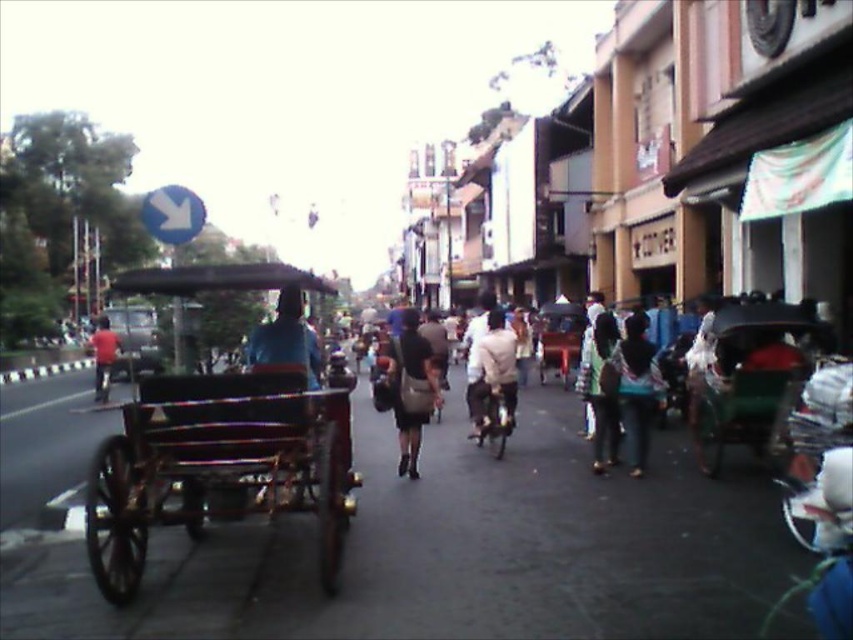
You are a delivery person who needs to decide which item to place on the top shelf of your storage unit. The shelf has limited height capacity. Which item should you choose between the dark brown leather bag at center and the light brown leather jacket at center?

The dark brown leather bag at center has a greater height compared to the light brown leather jacket at center, so you should choose the light brown leather jacket at center to place on the top shelf since it is shorter and less likely to exceed the height limit.

You are standing on the bustling street scene and want to take a photo. There are two points of interest marked as point (735, 369) and point (627, 336). Which point will appear larger in your photo?

Point (735, 369) is closer to the camera than point (627, 336), so it will appear larger in the photo.

Consider the image. You are a delivery person who needs to move a package from the wooden wagon at left to the matte black bag at center. Which direction should you move the package to ensure it reaches the correct destination?

You should move the package to the right since the wooden wagon at left is located to the left of the matte black wagon at center, so moving it to the right will bring it towards the matte black bag at center.